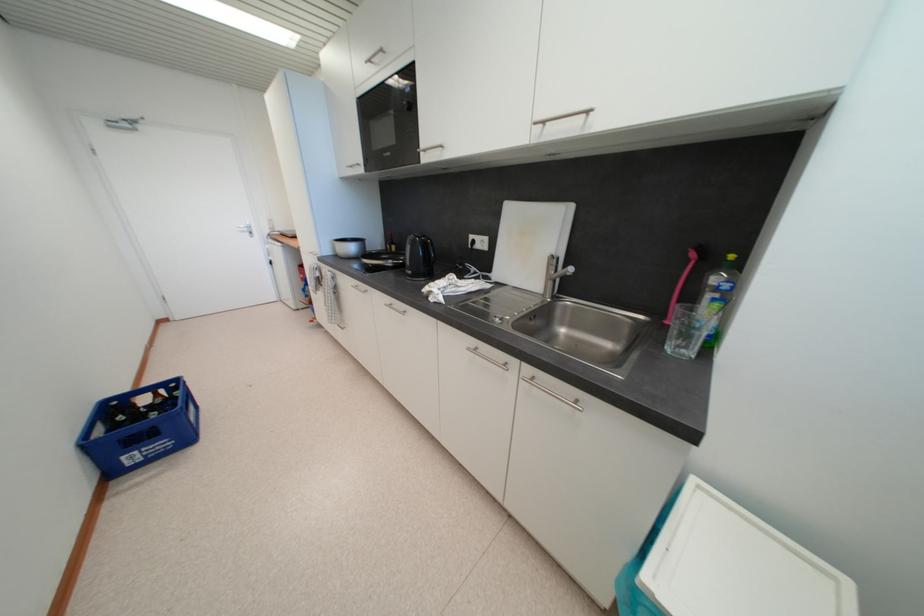
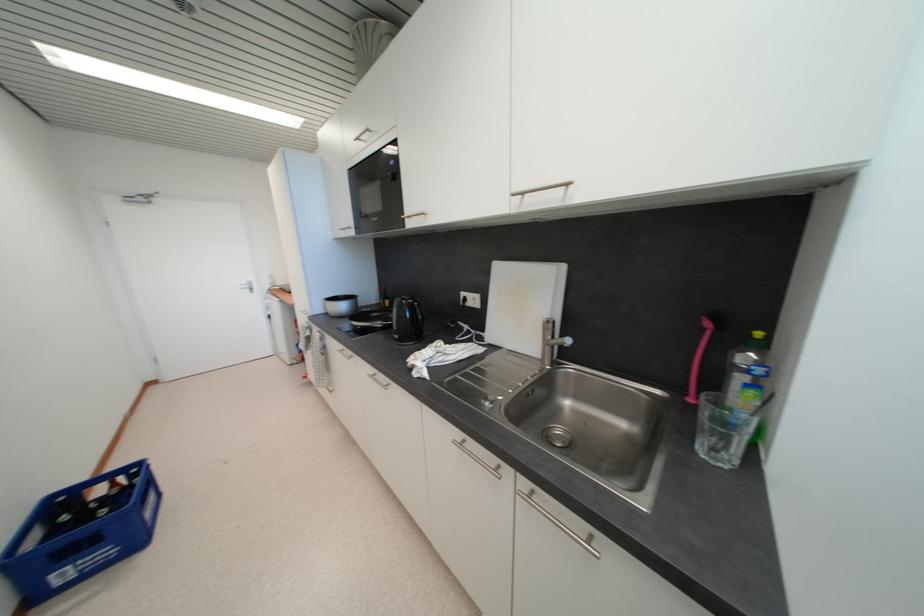
The point at (415,275) is marked in the first image. Where is the corresponding point in the second image?

(402, 339)